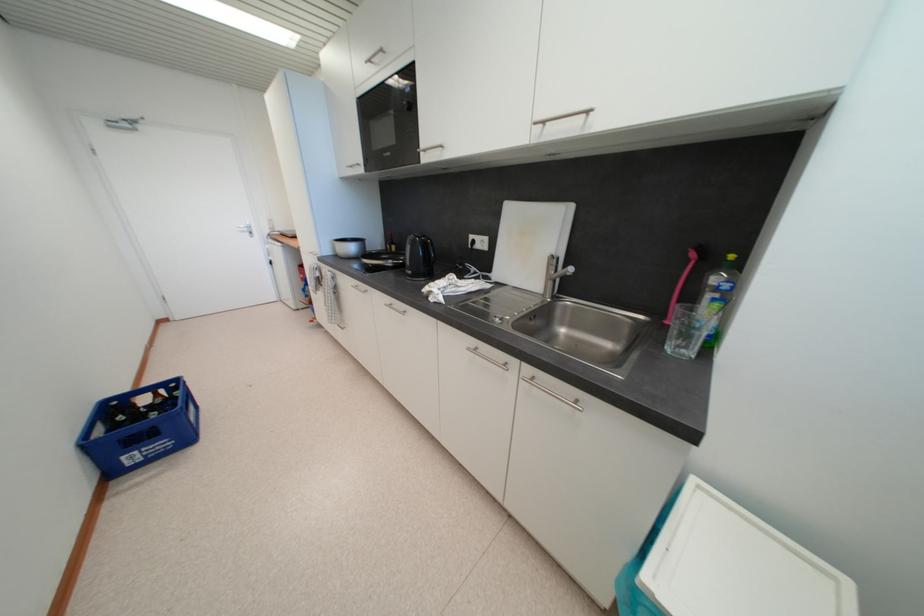
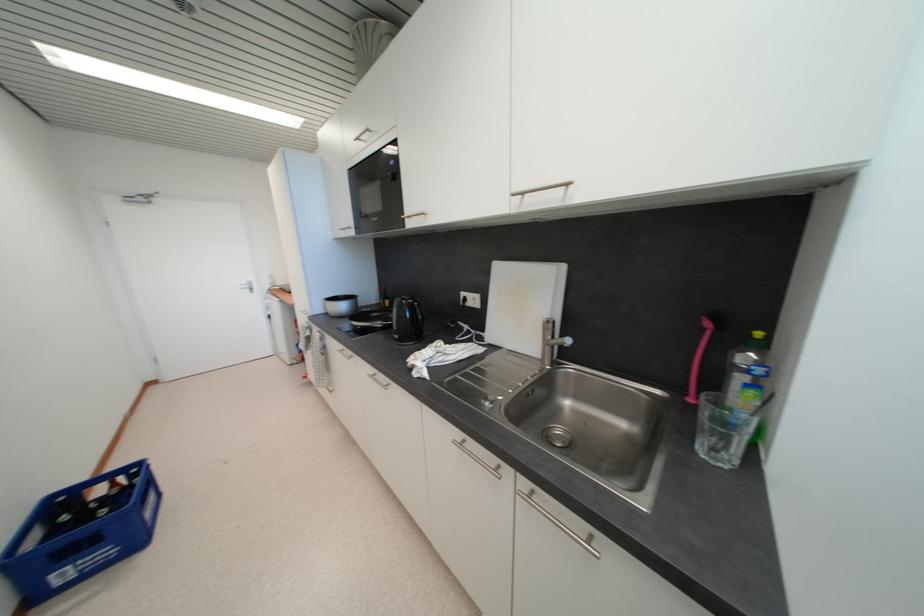
The point at (415,275) is marked in the first image. Where is the corresponding point in the second image?

(402, 339)